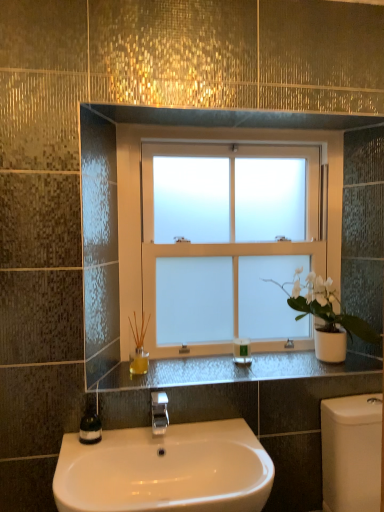
You are a GUI agent. You are given a task and a screenshot of the screen. Output one action in this format:
    pyautogui.click(x=<x>, y=<y>)
    Task: Click on the free location to the right of green glass soap dispenser at lower left
    The width and height of the screenshot is (384, 512).
    Given the screenshot: What is the action you would take?
    [133, 436]